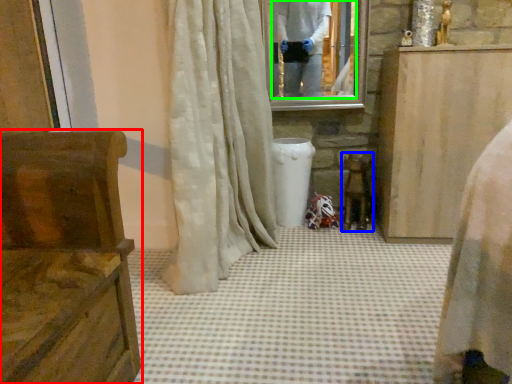
Question: Based on their relative distances, which object is nearer to furniture (highlighted by a red box)? Choose from chair (highlighted by a blue box) and mirror (highlighted by a green box).

Choices:
 (A) chair
 (B) mirror

Answer: (A)